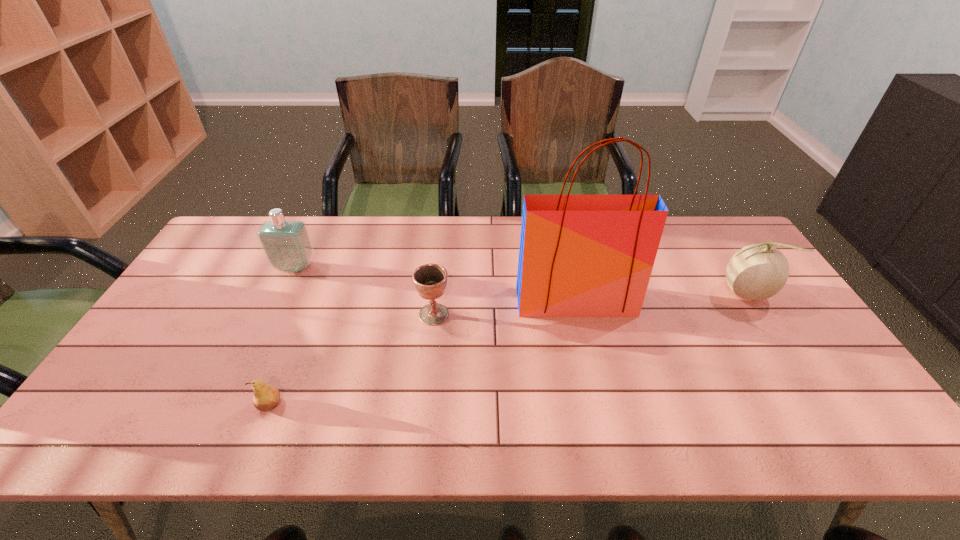
The height and width of the screenshot is (540, 960). Find the location of `vacant space that is in between the second shortest object and the farthest object`. vacant space that is in between the second shortest object and the farthest object is located at coordinates [x=365, y=291].

The width and height of the screenshot is (960, 540). In order to click on vacant region between the tallest object and the rightmost object in this screenshot , I will do `click(660, 297)`.

The height and width of the screenshot is (540, 960). In order to click on unoccupied area between the chalice and the shopping bag in this screenshot , I will do `click(505, 308)`.

Identify the location of vacant space that is in between the rightmost object and the pear. The height and width of the screenshot is (540, 960). (507, 349).

Find the location of a particular element. free space between the tallest object and the shortest object is located at coordinates (422, 353).

Where is `free spot between the cantaloup and the fourth object from right to left`? free spot between the cantaloup and the fourth object from right to left is located at coordinates (507, 349).

Where is `vacant area between the nearest object and the leftmost object`? Image resolution: width=960 pixels, height=540 pixels. vacant area between the nearest object and the leftmost object is located at coordinates (282, 336).

Identify which object is located as the nearest to the second object from right to left. Please provide its 2D coordinates. Your answer should be formatted as a tuple, i.e. [(x, y)], where the tuple contains the x and y coordinates of a point satisfying the conditions above.

[(430, 280)]

Where is `object that is the fourth closest to the perfume`? Image resolution: width=960 pixels, height=540 pixels. object that is the fourth closest to the perfume is located at coordinates (757, 272).

Find the location of `vacant region that satisfies the following two spatial constraints: 1. on the back side of the fourth object from right to left; 2. on the left side of the third object from left to right`. vacant region that satisfies the following two spatial constraints: 1. on the back side of the fourth object from right to left; 2. on the left side of the third object from left to right is located at coordinates (306, 314).